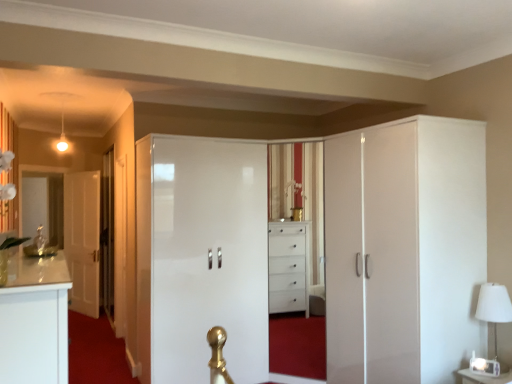
Question: Based on their positions, is white glossy door at left, which is the 1th door from left to right, located to the left or right of white glossy cupboard at right?

Choices:
 (A) right
 (B) left

Answer: (B)

Question: From the image's perspective, is white glossy door at left, which is the 2th door from front to back, positioned above or below white glossy cupboard at right?

Choices:
 (A) below
 (B) above

Answer: (A)

Question: Considering the real-world distances, which object is farthest from the white glossy cupboard at right?

Choices:
 (A) white glossy door at left, which is the 1th door from left to right
 (B) white glossy dresser at center
 (C) transparent glass door at left
 (D) white fabric lampshade at right
 (E) glossy white wardrobe at center, acting as the 1th door starting from the right

Answer: (A)

Question: Considering the real-world distances, which object is farthest from the white fabric lampshade at right?

Choices:
 (A) glossy white wardrobe at center, which ranks as the first door in front-to-back order
 (B) white glossy door at left, which is the 2th door from front to back
 (C) transparent glass door at left
 (D) white glossy dresser at center
 (E) white glossy cupboard at right

Answer: (B)